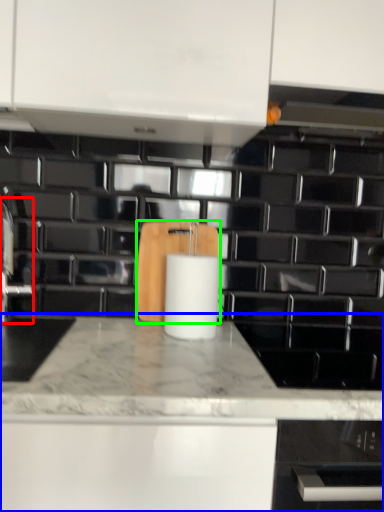
Question: Based on their relative distances, which object is farther from faucet (highlighted by a red box)? Choose from countertop (highlighted by a blue box) and cutting board (highlighted by a green box).

Choices:
 (A) countertop
 (B) cutting board

Answer: (A)